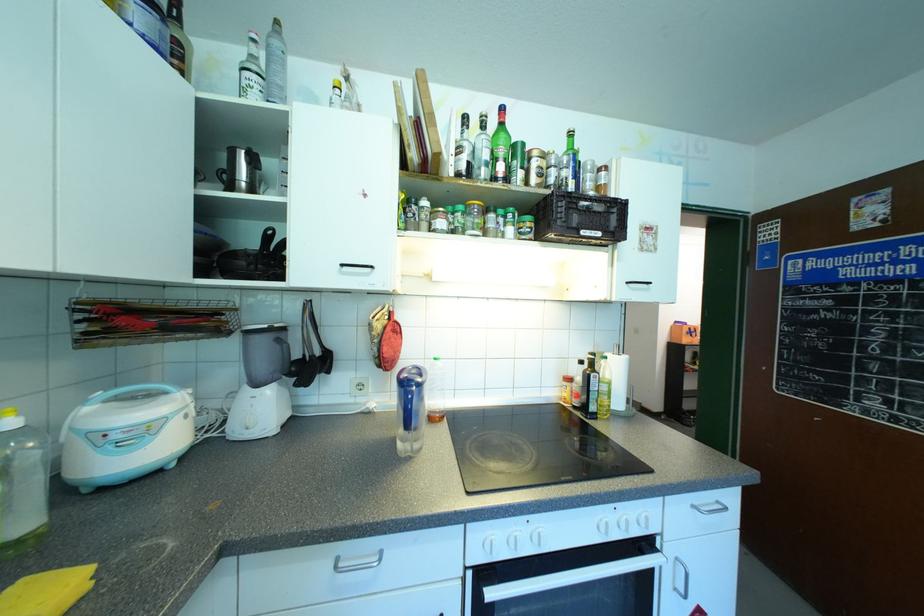
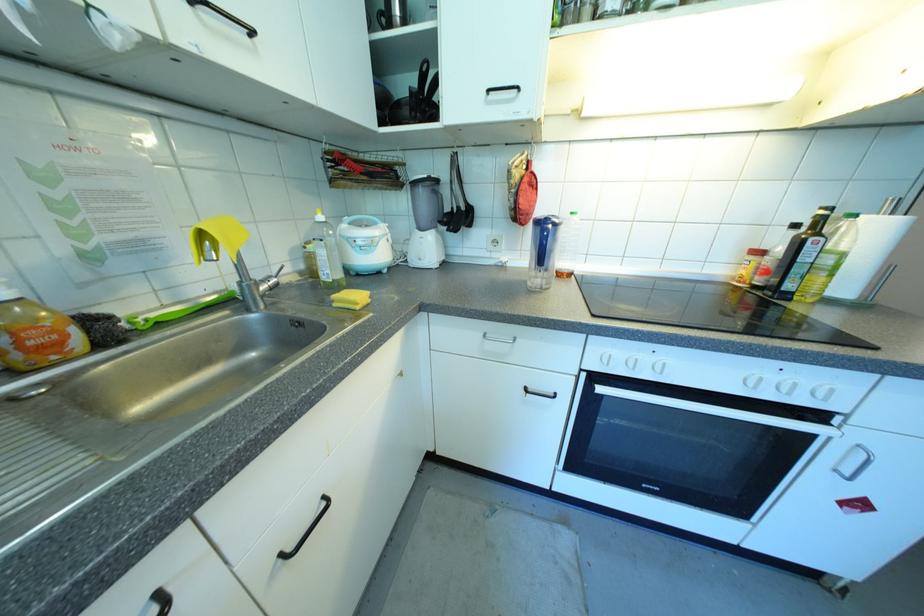
The first image is from the beginning of the video and the second image is from the end. How did the camera likely rotate when shooting the video?

The camera rotated toward left-down.